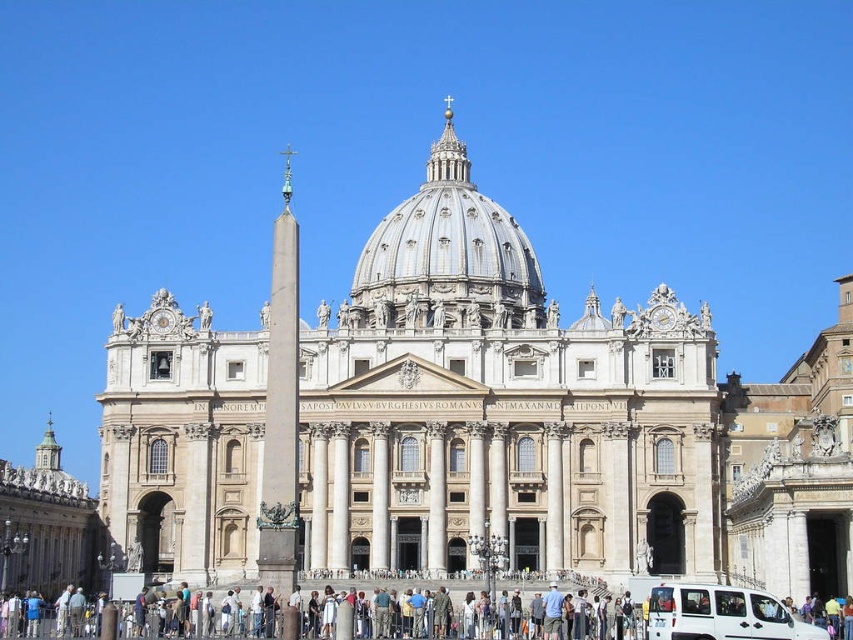
You are standing in front of the beige stone church at right. There is a point marked at coordinates (793, 468). Based on the description, where is this point located on the beige stone church at right?

The point at coordinates (793, 468) is on the beige stone church at right.